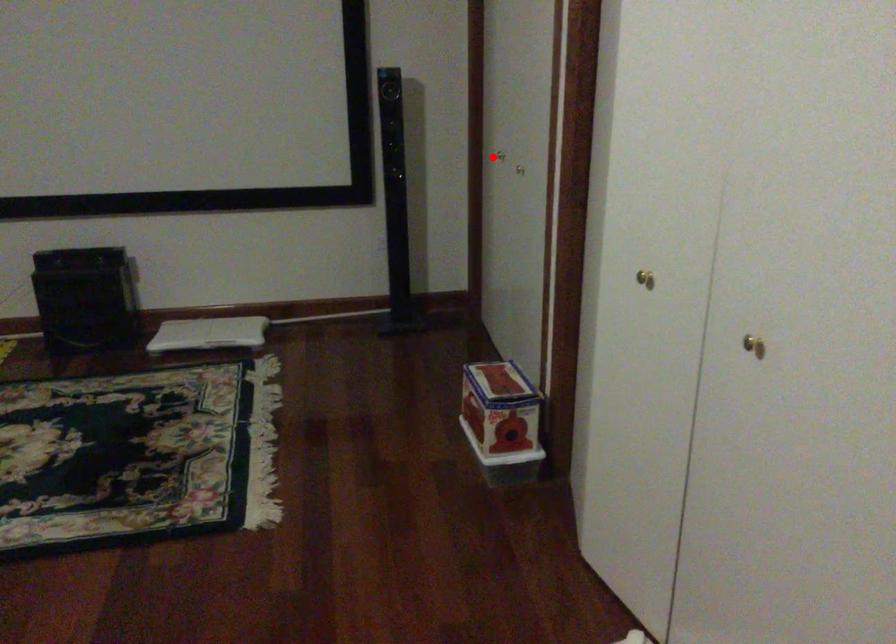
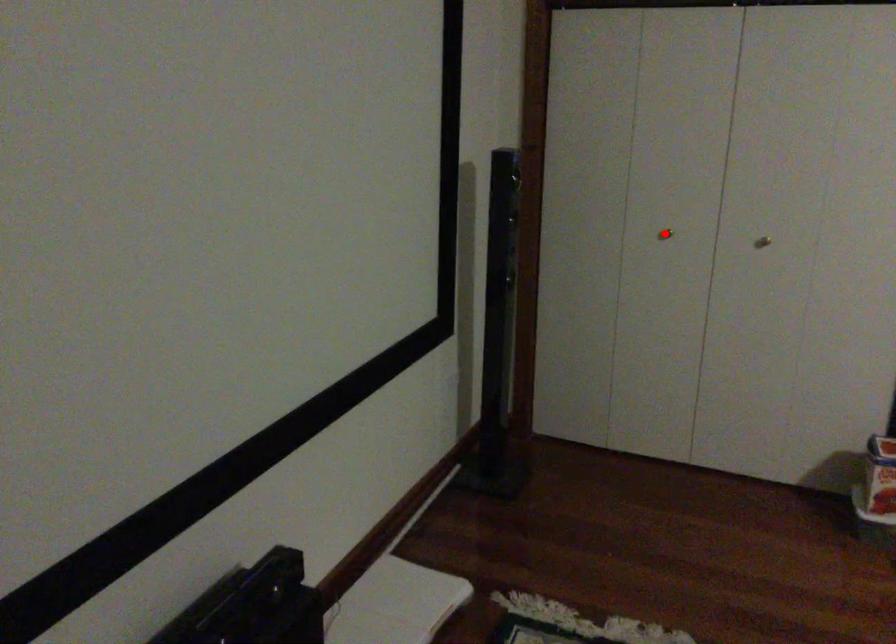
I am providing you with two images of the same scene from different viewpoints. A red point is marked on the first image and another point is marked on the second image. Do the highlighted points in image1 and image2 indicate the same real-world spot?

Yes